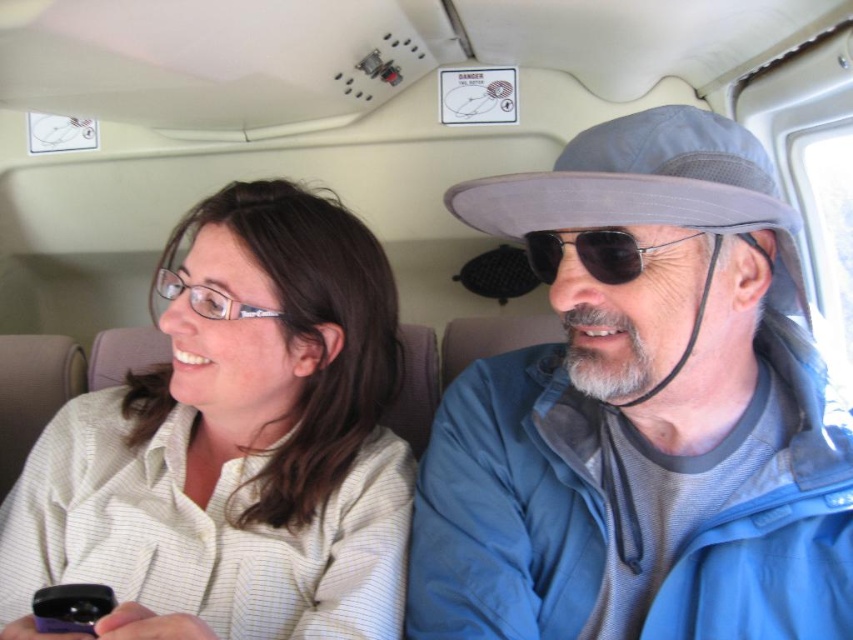
Question: Which point is closer to the camera?

Choices:
 (A) (676, 147)
 (B) (183, 589)
 (C) (231, 300)

Answer: (A)

Question: Which point is closer to the camera?

Choices:
 (A) white striped shirt at center
 (B) sunglasses at center

Answer: (A)

Question: Which of these objects is positioned farthest from the sunglasses at center?

Choices:
 (A) blue fabric jacket at right
 (B) clear plastic glasses at upper left
 (C) white striped shirt at center

Answer: (C)

Question: Can you confirm if white striped shirt at center is wider than clear plastic glasses at upper left?

Choices:
 (A) no
 (B) yes

Answer: (B)

Question: Is white striped shirt at center above clear plastic glasses at upper left?

Choices:
 (A) no
 (B) yes

Answer: (A)

Question: Observing the image, what is the correct spatial positioning of blue fabric jacket at right in reference to white striped shirt at center?

Choices:
 (A) below
 (B) above

Answer: (B)